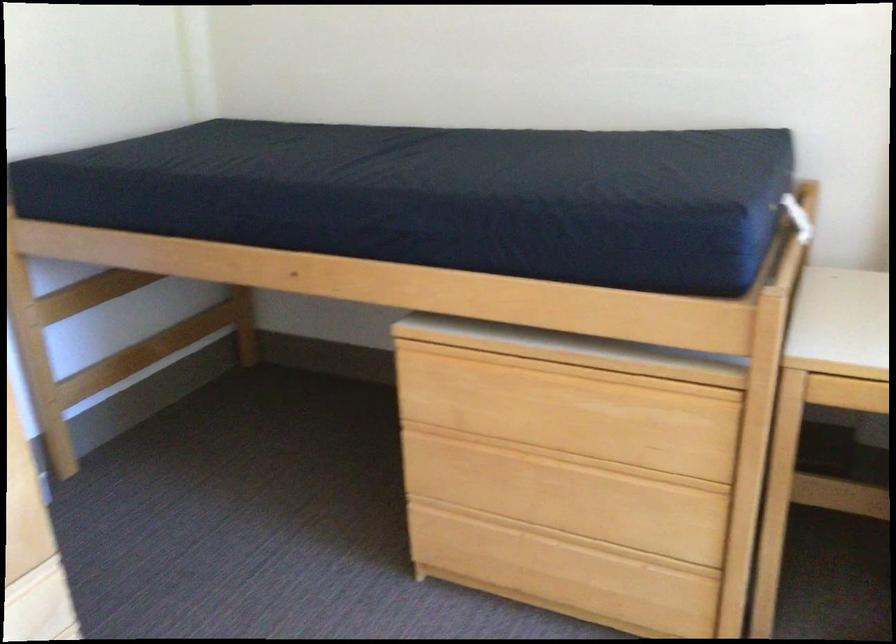
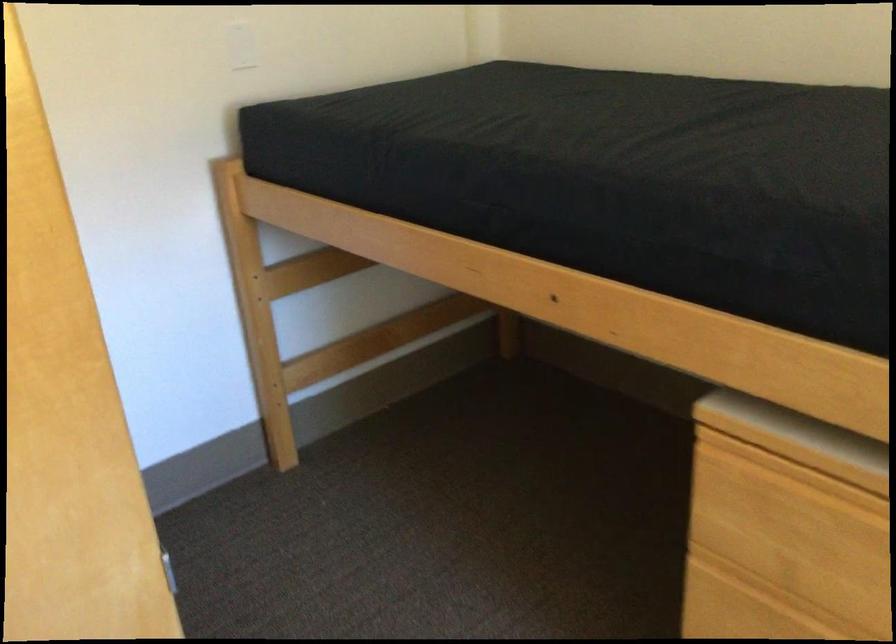
Question: Based on the continuous images, in which direction is the camera rotating? Reply with the corresponding letter.

Choices:
 (A) Left
 (B) Right
 (C) Up
 (D) Down

Answer: (A)